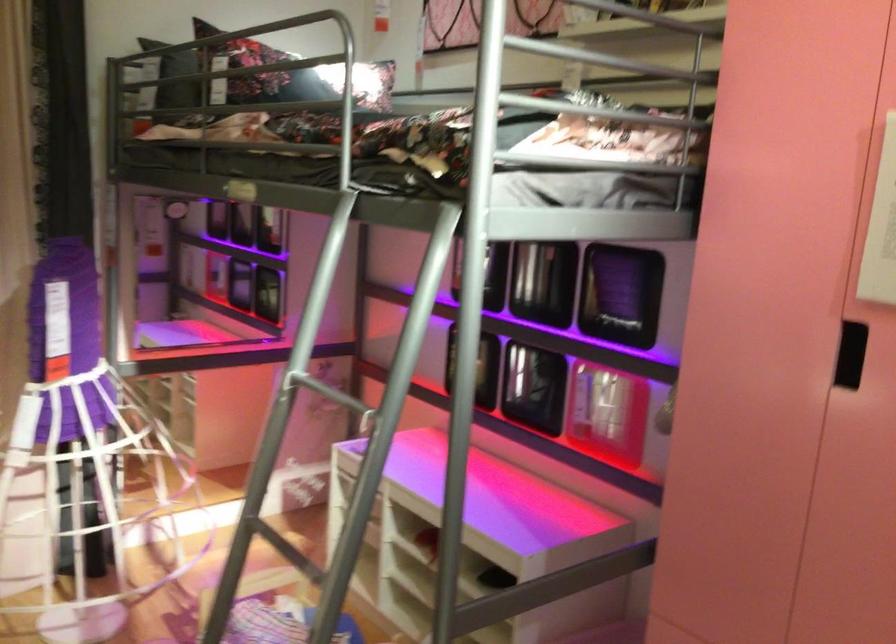
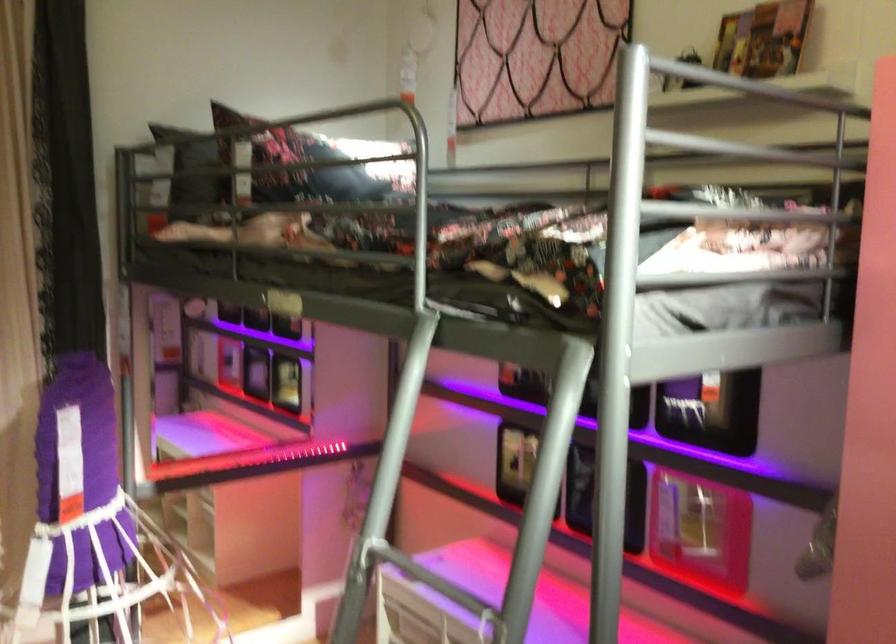
In the scene shown: The images are taken continuously from a first-person perspective. In which direction are you moving?

The cameraman walked toward left, forward.